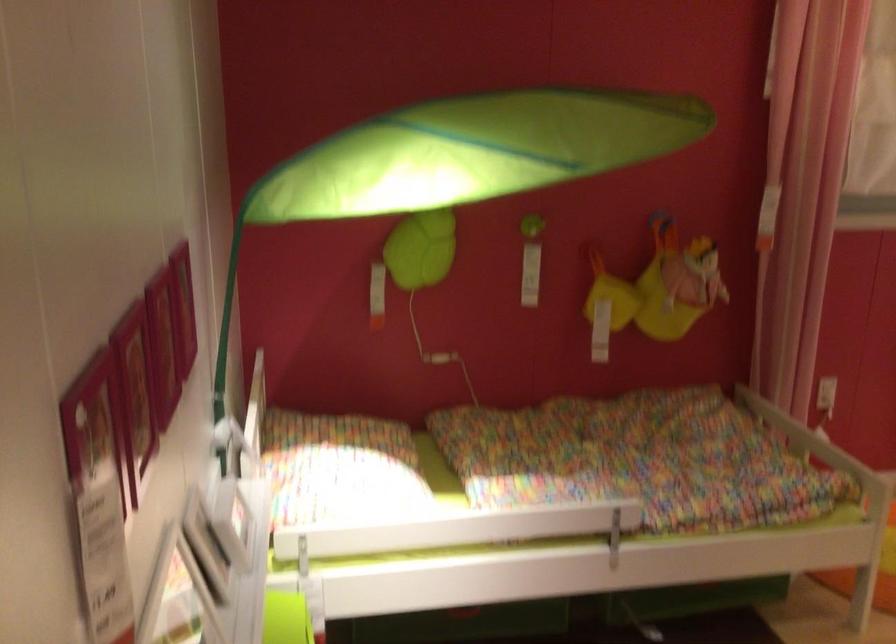
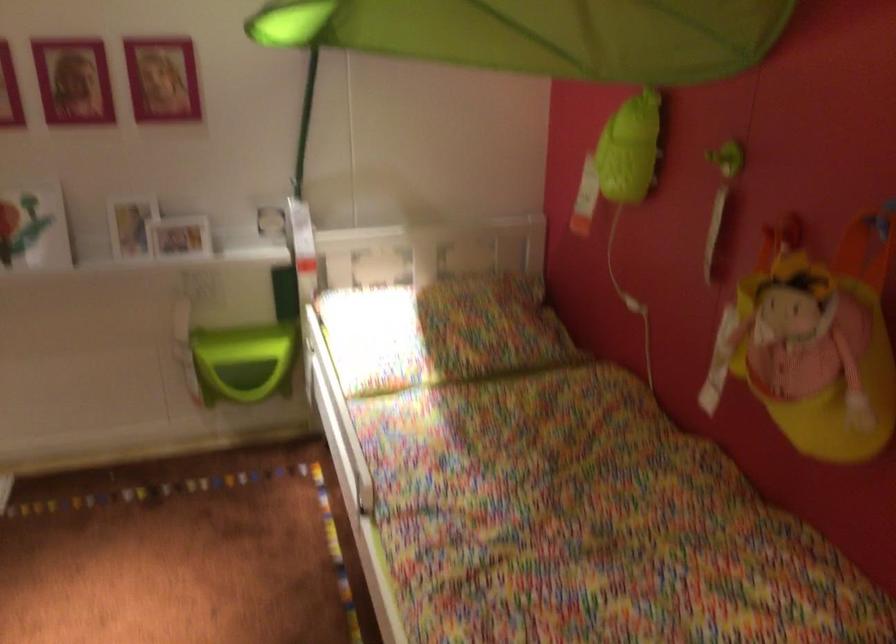
In the second image, find the point that corresponds to the point at 457,243 in the first image.

(629, 149)